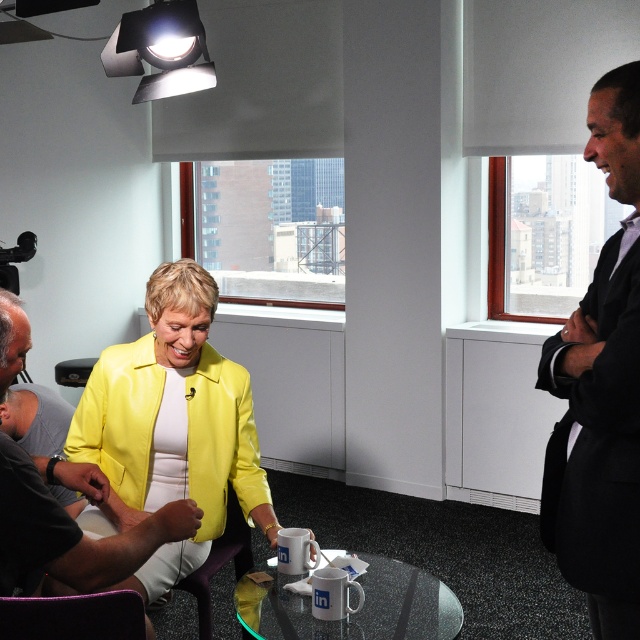
You are a fashion designer observing the yellow leather jacket at center and the matte black shirt at lower left in the image. Which item would you recommend for a client who prefers oversized styles?

The yellow leather jacket at center is larger in size than the matte black shirt at lower left, making it a better choice for someone who prefers oversized styles.

You are a delivery person who needs to place a small package on the clear glass table at center without it touching the yellow leather jacket at center. The package is 18 inches long. Is there enough space between them?

The yellow leather jacket at center is 19.50 inches from the clear glass table at center. Since the package is 18 inches long, placing it between them would leave 1.5 inches of space, which is enough to prevent contact.

You are organizing a charity event and need to decide which outfit to donate. You have the black suit at right and the matte black shirt at lower left. Based on their sizes, which one should you choose if you want to donate the larger item?

The black suit at right is bigger than the matte black shirt at lower left, so you should donate the black suit at right as it is the larger item.